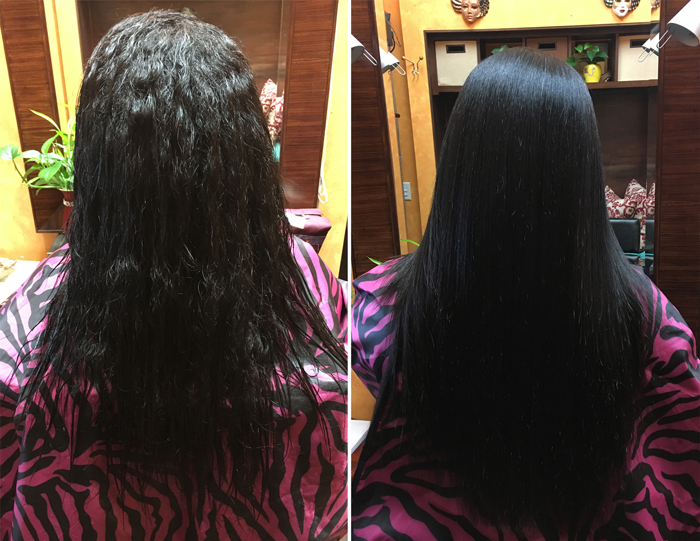
Find the location of a particular element. light switch is located at coordinates (409, 192).